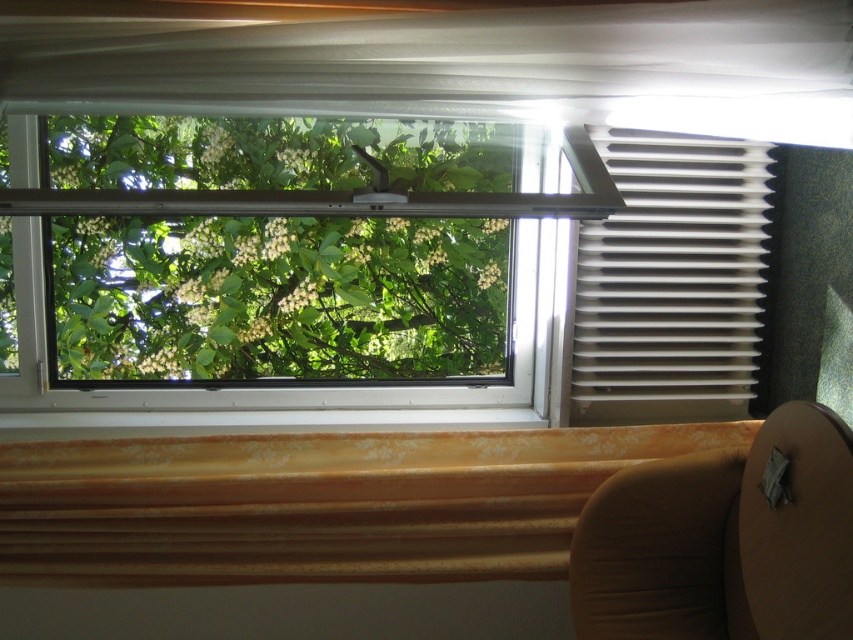
You are standing in the room depicted in the image. You want to reach the yellow textured curtain at lower center. Which direction should you move from your current position at point (314,502)?

The point (314,502) is exactly where the yellow textured curtain at lower center is located, so you are already there.

You are an interior designer assessing the room. You need to determine if the white plastic blinds at right can block the view of the green leafy tree at center when closed. Based on their sizes, what do you conclude?

The green leafy tree at center is wider than the white plastic blinds at right. Since the tree is wider, the blinds cannot fully block the view of the tree when closed.

Looking at this image, you are standing in the room and want to touch the green leafy tree at center through the open window. Considering your arm can reach 1.5 meters, will you be able to reach it?

The green leafy tree at center and viewer are 1.88 meters apart from each other. Since your arm can only reach 1.5 meters, you cannot reach the green leafy tree at center.